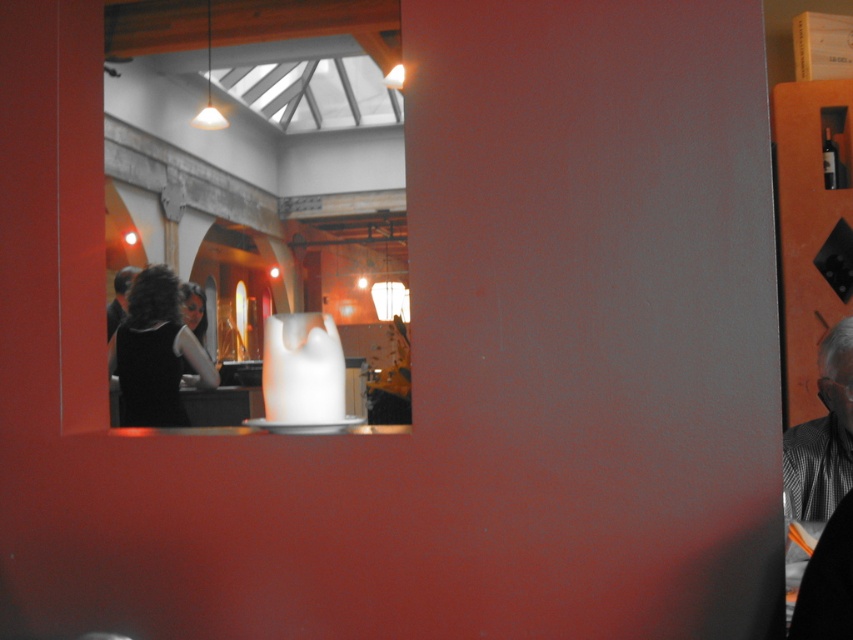
Question: Which is farther from the black matte dress at lower left?

Choices:
 (A) gray checkered shirt at right
 (B) dark brown hair at left

Answer: (A)

Question: Does gray checkered shirt at right have a larger size compared to dark brown hair at left?

Choices:
 (A) yes
 (B) no

Answer: (B)

Question: Is black matte dress at lower left closer to camera compared to dark brown hair at left?

Choices:
 (A) no
 (B) yes

Answer: (B)

Question: Which point appears closest to the camera in this image?

Choices:
 (A) (149, 340)
 (B) (827, 621)
 (C) (117, 289)

Answer: (B)

Question: Can you confirm if gray checkered shirt at right is bigger than dark brown hair at left?

Choices:
 (A) no
 (B) yes

Answer: (A)

Question: Among these objects, which one is nearest to the camera?

Choices:
 (A) dark brown hair at left
 (B) black matte dress at lower left
 (C) gray checkered shirt at right

Answer: (C)